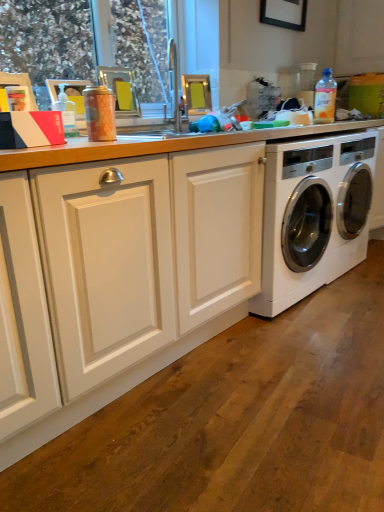
This screenshot has height=512, width=384. What do you see at coordinates (313, 215) in the screenshot? I see `white glossy washing machine at right` at bounding box center [313, 215].

The image size is (384, 512). Describe the element at coordinates (120, 267) in the screenshot. I see `white wood countertop at center` at that location.

Where is `transparent plastic window screen at upper left`? transparent plastic window screen at upper left is located at coordinates (48, 39).

This screenshot has height=512, width=384. What do you see at coordinates (325, 98) in the screenshot?
I see `translucent plastic bottle at upper right, which is counted as the 2th bottle, starting from the left` at bounding box center [325, 98].

You are a GUI agent. You are given a task and a screenshot of the screen. Output one action in this format:
    pyautogui.click(x=<x>, y=<y>)
    Task: Click on the white glossy washing machine at right
    
    Given the screenshot: What is the action you would take?
    pyautogui.click(x=313, y=215)

Which is more to the right, white glossy washing machine at right or white wood countertop at center?

white glossy washing machine at right.

Are white glossy washing machine at right and white wood countertop at center far apart?

No, there isn't a large distance between white glossy washing machine at right and white wood countertop at center.

Consider the image. Considering the sizes of objects white glossy washing machine at right and white wood countertop at center in the image provided, who is smaller, white glossy washing machine at right or white wood countertop at center?

white wood countertop at center is smaller.

Does white glossy washing machine at right lie in front of white wood countertop at center?

No, it is behind white wood countertop at center.

Is point (141, 254) behind point (62, 119)?

No, it is in front of (62, 119).

Does white wood countertop at center lie behind transparent plastic bottle at upper left, marked as the 2th bottle in a back-to-front arrangement?

That is False.

Measure the distance from white wood countertop at center to transparent plastic bottle at upper left, arranged as the first bottle when ordered from the bottom.

25.24 inches.

In terms of width, does white wood countertop at center look wider or thinner when compared to transparent plastic bottle at upper left, the 1th bottle from the front?

Considering their sizes, white wood countertop at center looks broader than transparent plastic bottle at upper left, the 1th bottle from the front.

Considering the sizes of objects white wood countertop at center and translucent plastic bottle at upper right, which is counted as the 2th bottle, starting from the left, in the image provided, who is wider, white wood countertop at center or translucent plastic bottle at upper right, which is counted as the 2th bottle, starting from the left,?

Wider between the two is white wood countertop at center.

From the image's perspective, who appears lower, white wood countertop at center or translucent plastic bottle at upper right, which is counted as the 2th bottle, starting from the left?

From the image's view, white wood countertop at center is below.

The height and width of the screenshot is (512, 384). I want to click on countertop that appears below the translucent plastic bottle at upper right, placed as the first bottle when sorted from top to bottom (from a real-world perspective), so [120, 267].

Between point (370, 149) and point (168, 80), which one is positioned in front?

Positioned in front is point (370, 149).

Considering their positions, is white glossy washing machine at right located in front of or behind transparent plastic window screen at upper left?

In the image, white glossy washing machine at right appears behind transparent plastic window screen at upper left.

From the image's perspective, is transparent plastic bottle at upper left, the first bottle from the left, positioned above or below matte silver sink at upper center?

transparent plastic bottle at upper left, the first bottle from the left, is situated lower than matte silver sink at upper center in the image.

Locate an element on the screen. sink behind the transparent plastic bottle at upper left, the 1th bottle from the front is located at coordinates (173, 105).

Which is more distant, (x=61, y=91) or (x=166, y=105)?

The point (x=166, y=105) is farther.

Is transparent plastic bottle at upper left, arranged as the second bottle when viewed from the right, directly adjacent to matte silver sink at upper center?

transparent plastic bottle at upper left, arranged as the second bottle when viewed from the right, is not next to matte silver sink at upper center, and they're not touching.

From a real-world perspective, which object stands above the other?

translucent plastic bottle at upper right, placed as the first bottle when sorted from top to bottom.

Which is more distant, [329,71] or [273,275]?

Point [329,71]

How distant is translucent plastic bottle at upper right, the 1th bottle positioned from the back, from white glossy washing machine at right?

A distance of 21.74 inches exists between translucent plastic bottle at upper right, the 1th bottle positioned from the back, and white glossy washing machine at right.

Is translucent plastic bottle at upper right, which is counted as the 2th bottle, starting from the left, positioned beyond the bounds of white glossy washing machine at right?

Yes, translucent plastic bottle at upper right, which is counted as the 2th bottle, starting from the left, is located beyond the bounds of white glossy washing machine at right.

Is point (296, 150) in front of point (72, 136)?

No, (296, 150) is further to viewer.

Would you say transparent plastic bottle at upper left, the second bottle from the top, is part of white glossy washing machine at right's contents?

That's incorrect, transparent plastic bottle at upper left, the second bottle from the top, is not inside white glossy washing machine at right.

Which object is positioned more to the right, white glossy washing machine at right or transparent plastic bottle at upper left, the first bottle from the left?

From the viewer's perspective, white glossy washing machine at right appears more on the right side.

Considering the sizes of objects white glossy washing machine at right and transparent plastic bottle at upper left, arranged as the second bottle when viewed from the right, in the image provided, who is bigger, white glossy washing machine at right or transparent plastic bottle at upper left, arranged as the second bottle when viewed from the right,?

white glossy washing machine at right.

Where is `countertop below the white glossy washing machine at right (from the image's perspective)`? This screenshot has width=384, height=512. countertop below the white glossy washing machine at right (from the image's perspective) is located at coordinates (120, 267).

Where is `countertop on the right of the transparent plastic bottle at upper left, marked as the 2th bottle in a back-to-front arrangement`? countertop on the right of the transparent plastic bottle at upper left, marked as the 2th bottle in a back-to-front arrangement is located at coordinates (120, 267).

Based on the photo, from the image, which object appears to be farther from white glossy washing machine at right, white wood countertop at center or translucent plastic bottle at upper right, the 2th bottle positioned from the bottom?

white wood countertop at center.

Looking at the image, which one is located closer to transparent plastic window screen at upper left, white wood countertop at center or matte silver sink at upper center?

matte silver sink at upper center is positioned closer to the anchor transparent plastic window screen at upper left.

Looking at the image, which one is located further to white glossy washing machine at right, transparent plastic bottle at upper left, the 1th bottle from the front, or translucent plastic bottle at upper right, placed as the first bottle when sorted from top to bottom?

transparent plastic bottle at upper left, the 1th bottle from the front, is further to white glossy washing machine at right.

From the image, which object appears to be farther from transparent plastic window screen at upper left, translucent plastic bottle at upper right, the 1th bottle positioned from the back, or matte silver sink at upper center?

translucent plastic bottle at upper right, the 1th bottle positioned from the back, lies further to transparent plastic window screen at upper left than the other object.

Estimate the real-world distances between objects in this image. Which object is closer to translucent plastic bottle at upper right, positioned as the 2th bottle in front-to-back order, white glossy washing machine at right or matte silver sink at upper center?

Among the two, white glossy washing machine at right is located nearer to translucent plastic bottle at upper right, positioned as the 2th bottle in front-to-back order.

Based on their spatial positions, is matte silver sink at upper center or transparent plastic window screen at upper left further from white wood countertop at center?

transparent plastic window screen at upper left lies further to white wood countertop at center than the other object.

Estimate the real-world distances between objects in this image. Which object is further from matte silver sink at upper center, translucent plastic bottle at upper right, which is counted as the 1th bottle, starting from the right, or transparent plastic window screen at upper left?

transparent plastic window screen at upper left is positioned further to the anchor matte silver sink at upper center.

When comparing their distances from translucent plastic bottle at upper right, the 2th bottle positioned from the bottom, does matte silver sink at upper center or transparent plastic bottle at upper left, the first bottle from the left, seem closer?

matte silver sink at upper center lies closer to translucent plastic bottle at upper right, the 2th bottle positioned from the bottom, than the other object.

Where is `bottle between transparent plastic window screen at upper left and white glossy washing machine at right in the horizontal direction`? bottle between transparent plastic window screen at upper left and white glossy washing machine at right in the horizontal direction is located at coordinates (325, 98).

What are the coordinates of `bottle between matte silver sink at upper center and white glossy washing machine at right` in the screenshot? It's located at (325, 98).

I want to click on sink between transparent plastic window screen at upper left and white wood countertop at center vertically, so click(x=173, y=105).

Locate an element on the screen. This screenshot has width=384, height=512. window screen between transparent plastic bottle at upper left, the 1th bottle from the front, and white glossy washing machine at right from left to right is located at coordinates (48, 39).